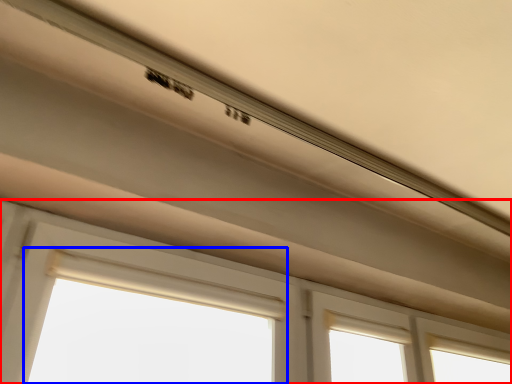
Question: Which object is closer to the camera taking this photo, window (highlighted by a red box) or bay window (highlighted by a blue box)?

Choices:
 (A) window
 (B) bay window

Answer: (A)